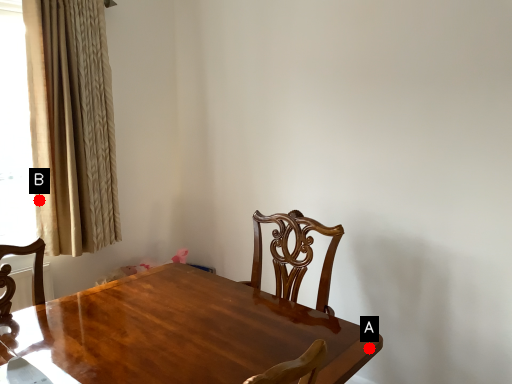
Question: Two points are circled on the image, labeled by A and B beside each circle. Which point is further to the camera?

Choices:
 (A) A is further
 (B) B is further

Answer: (B)